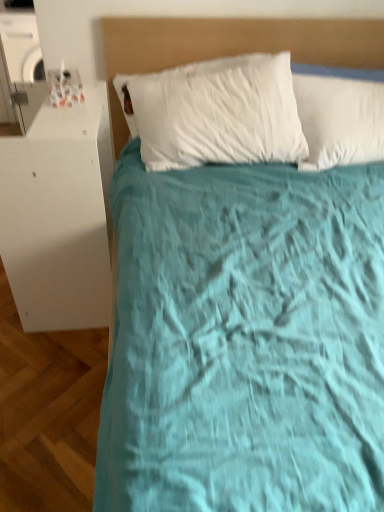
Question: Can you confirm if white glossy cabinet at left is thinner than matte beige headboard at upper center?

Choices:
 (A) yes
 (B) no

Answer: (B)

Question: Would you say white glossy cabinet at left contains matte beige headboard at upper center?

Choices:
 (A) no
 (B) yes

Answer: (A)

Question: From a real-world perspective, does white glossy cabinet at left stand above matte beige headboard at upper center?

Choices:
 (A) yes
 (B) no

Answer: (B)

Question: From a real-world perspective, is white glossy cabinet at left beneath matte beige headboard at upper center?

Choices:
 (A) yes
 (B) no

Answer: (A)

Question: Considering the relative positions of white glossy cabinet at left and matte beige headboard at upper center in the image provided, is white glossy cabinet at left to the right of matte beige headboard at upper center from the viewer's perspective?

Choices:
 (A) no
 (B) yes

Answer: (A)

Question: Are white glossy cabinet at left and matte beige headboard at upper center located far from each other?

Choices:
 (A) yes
 (B) no

Answer: (B)

Question: Is matte beige headboard at upper center thinner than white glossy cabinet at left?

Choices:
 (A) yes
 (B) no

Answer: (A)

Question: Can you confirm if matte beige headboard at upper center is positioned to the right of white glossy cabinet at left?

Choices:
 (A) yes
 (B) no

Answer: (A)

Question: Is matte beige headboard at upper center closer to camera compared to white glossy cabinet at left?

Choices:
 (A) yes
 (B) no

Answer: (B)

Question: Is the depth of matte beige headboard at upper center greater than that of white glossy cabinet at left?

Choices:
 (A) no
 (B) yes

Answer: (B)

Question: From the image's perspective, is matte beige headboard at upper center located beneath white glossy cabinet at left?

Choices:
 (A) no
 (B) yes

Answer: (A)

Question: From a real-world perspective, is matte beige headboard at upper center positioned under white glossy cabinet at left based on gravity?

Choices:
 (A) no
 (B) yes

Answer: (A)

Question: From a real-world perspective, is white glossy cabinet at left physically located above or below matte beige headboard at upper center?

Choices:
 (A) below
 (B) above

Answer: (A)